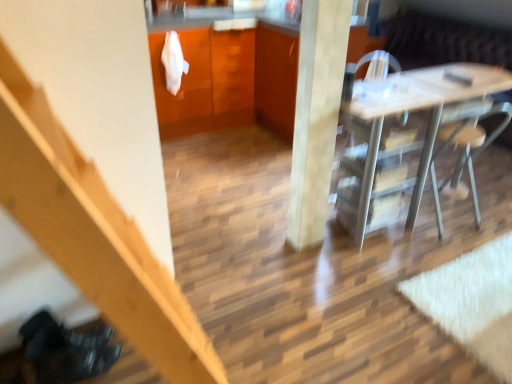
This screenshot has height=384, width=512. I want to click on free space in front of smooth light wood pillar at center, so tap(313, 269).